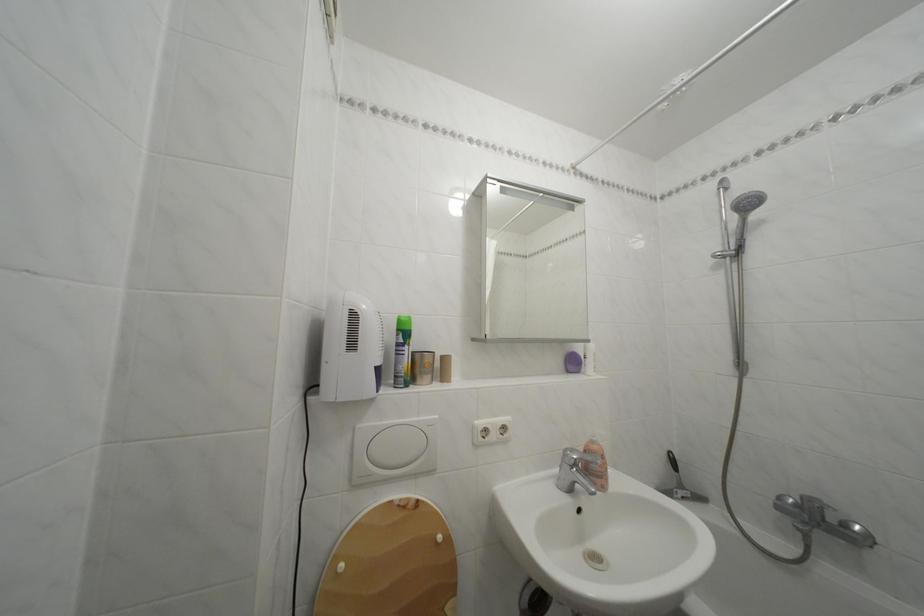
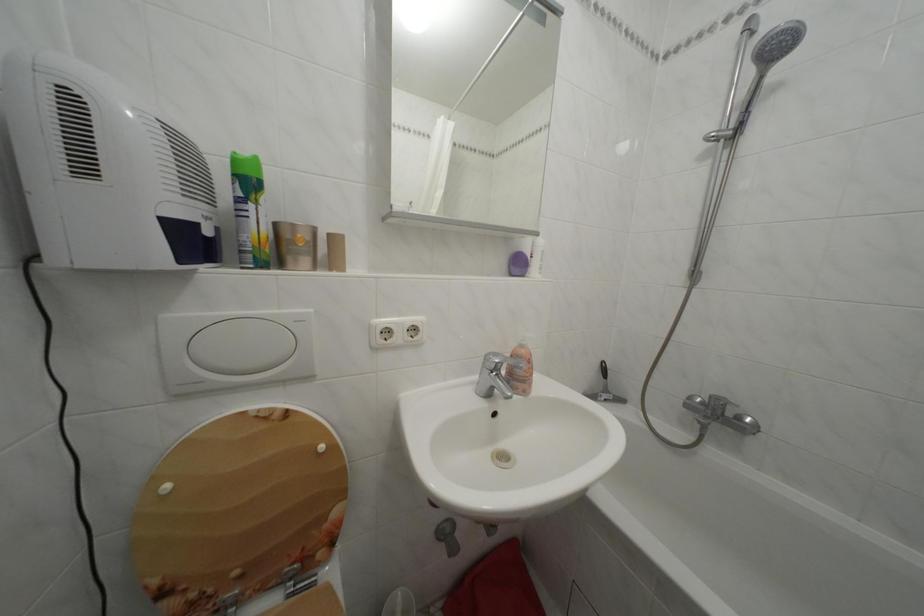
In a continuous first-person perspective shot, in which direction is the camera moving?

The cameraman moved toward right, forward.